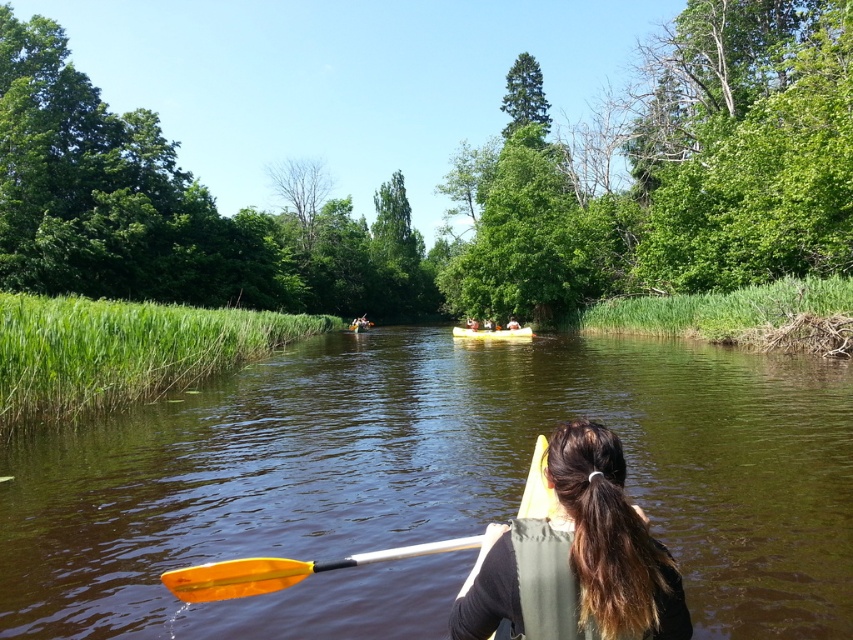
You are standing on the riverbank and see the brown smooth water at center and the orange plastic paddle at lower center. Which object is closer to the water surface?

The orange plastic paddle at lower center is closer to the water surface because it is located above the brown smooth water at center.